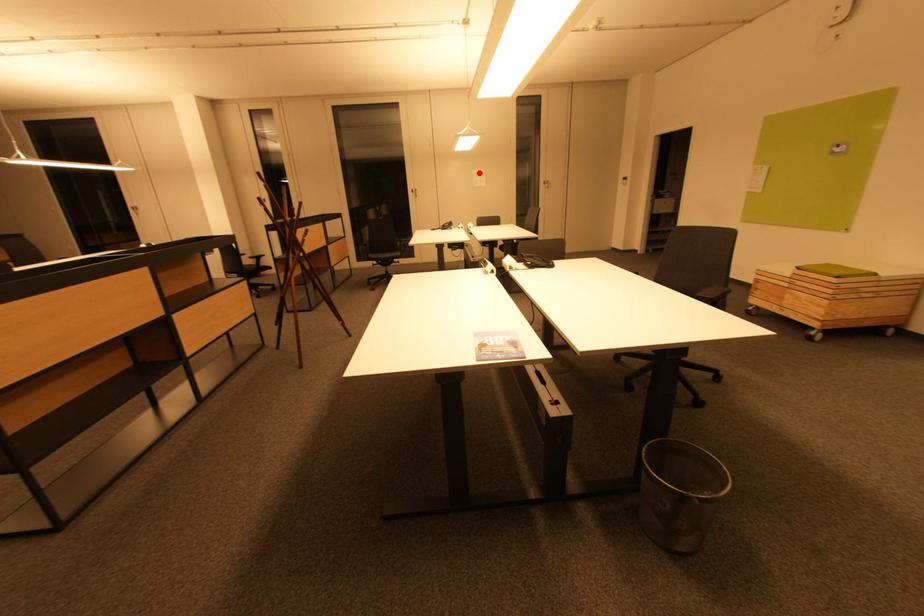
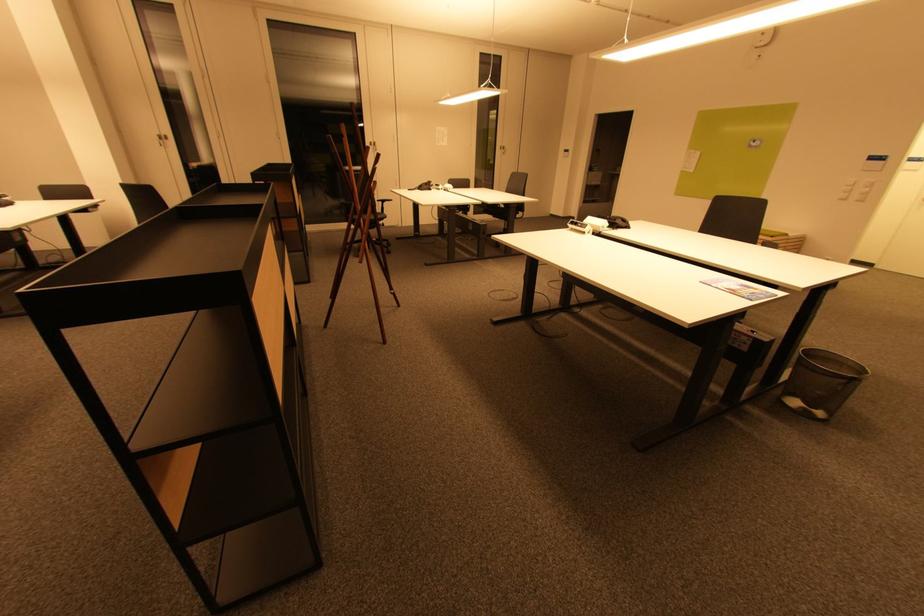
In the second image, find the point that corresponds to the highlighted location in the first image.

(442, 130)